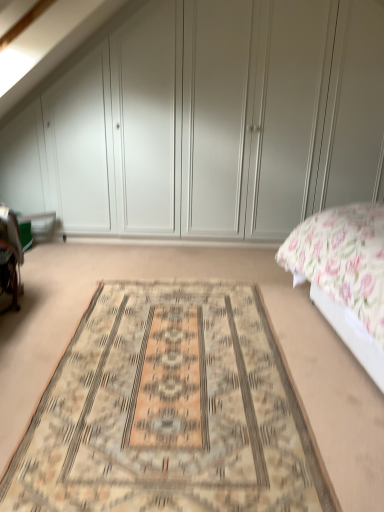
Question: From a real-world perspective, is white matte wardrobe at upper center physically above floral fabric bed at right?

Choices:
 (A) yes
 (B) no

Answer: (A)

Question: From a real-world perspective, does white matte wardrobe at upper center sit lower than floral fabric bed at right?

Choices:
 (A) yes
 (B) no

Answer: (B)

Question: Does white matte wardrobe at upper center turn towards floral fabric bed at right?

Choices:
 (A) no
 (B) yes

Answer: (B)

Question: Does white matte wardrobe at upper center lie in front of floral fabric bed at right?

Choices:
 (A) yes
 (B) no

Answer: (B)

Question: Can you confirm if white matte wardrobe at upper center is positioned to the left of floral fabric bed at right?

Choices:
 (A) yes
 (B) no

Answer: (A)

Question: Can you confirm if white matte wardrobe at upper center is shorter than floral fabric bed at right?

Choices:
 (A) yes
 (B) no

Answer: (B)

Question: Is floral fabric bed at right not inside white matte wardrobe at upper center?

Choices:
 (A) no
 (B) yes

Answer: (B)

Question: Does floral fabric bed at right contain white matte wardrobe at upper center?

Choices:
 (A) yes
 (B) no

Answer: (B)

Question: Considering the relative sizes of floral fabric bed at right and white matte wardrobe at upper center in the image provided, is floral fabric bed at right wider than white matte wardrobe at upper center?

Choices:
 (A) yes
 (B) no

Answer: (A)

Question: Is floral fabric bed at right at the right side of white matte wardrobe at upper center?

Choices:
 (A) no
 (B) yes

Answer: (B)

Question: Considering the relative sizes of floral fabric bed at right and white matte wardrobe at upper center in the image provided, is floral fabric bed at right taller than white matte wardrobe at upper center?

Choices:
 (A) no
 (B) yes

Answer: (A)

Question: Is floral fabric bed at right turned away from white matte wardrobe at upper center?

Choices:
 (A) yes
 (B) no

Answer: (B)

Question: Considering the relative sizes of white matte wardrobe at upper center and beige woven rug at center in the image provided, is white matte wardrobe at upper center bigger than beige woven rug at center?

Choices:
 (A) yes
 (B) no

Answer: (A)